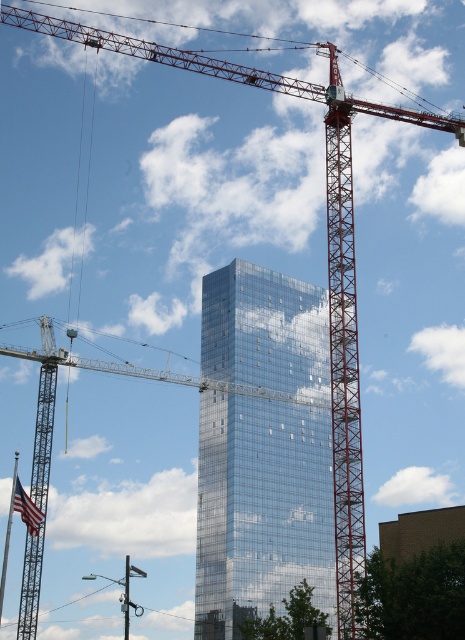
Question: Among these objects, which one is nearest to the camera?

Choices:
 (A) metallic gray crane at center
 (B) glassy reflective skyscraper at center

Answer: (A)

Question: Can you confirm if glassy reflective skyscraper at center is wider than metallic gray crane at center?

Choices:
 (A) no
 (B) yes

Answer: (A)

Question: Observing the image, what is the correct spatial positioning of glassy reflective skyscraper at center in reference to metallic gray crane at center?

Choices:
 (A) right
 (B) left

Answer: (A)

Question: In this image, where is glassy reflective skyscraper at center located relative to metallic gray crane at center?

Choices:
 (A) below
 (B) above

Answer: (A)

Question: Which of the following is the farthest from the observer?

Choices:
 (A) (50, 449)
 (B) (307, 356)

Answer: (B)